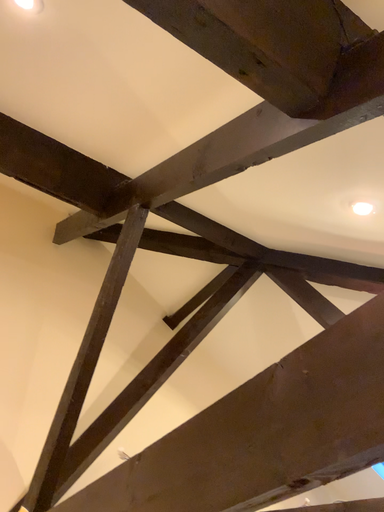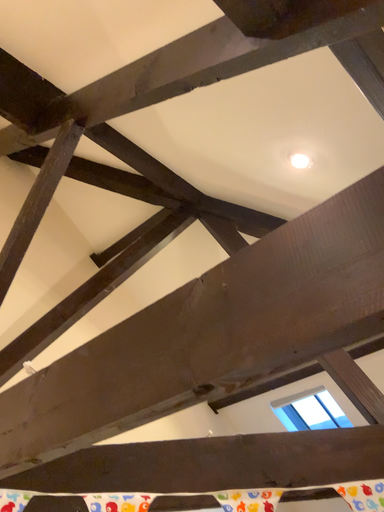
Question: How did the camera likely rotate when shooting the video?

Choices:
 (A) rotated upward
 (B) rotated downward

Answer: (B)